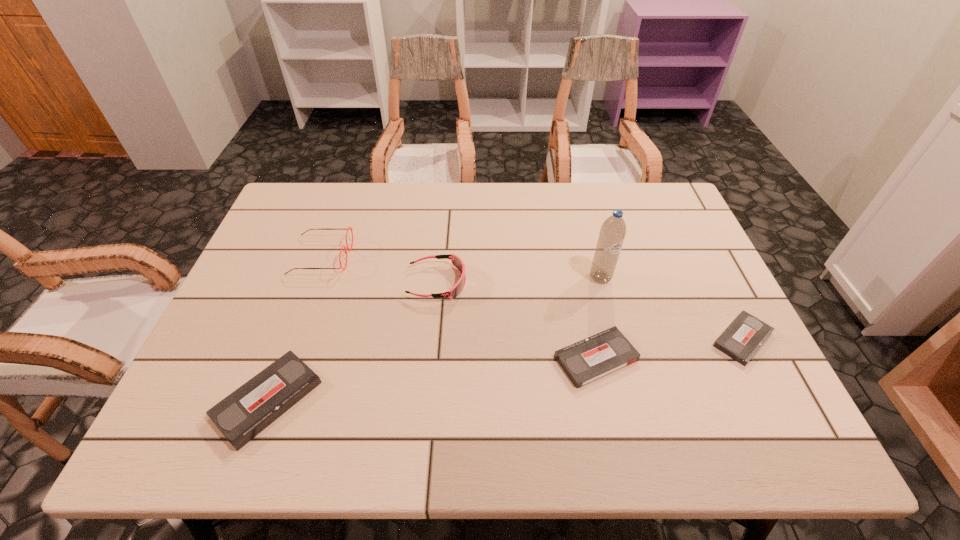
This screenshot has height=540, width=960. I want to click on vacant space located on the left of the second tallest videotape, so click(x=519, y=358).

Where is `free spot located on the back of the shortest object`? The width and height of the screenshot is (960, 540). free spot located on the back of the shortest object is located at coordinates (711, 278).

Image resolution: width=960 pixels, height=540 pixels. Find the location of `vacant space situated 0.390m on the front-facing side of the second tallest object`. vacant space situated 0.390m on the front-facing side of the second tallest object is located at coordinates (486, 256).

This screenshot has width=960, height=540. I want to click on blank space located on the front-facing side of the fourth shortest object, so click(515, 283).

The height and width of the screenshot is (540, 960). Identify the location of free space located 0.120m on the right of the tallest object. (656, 278).

I want to click on videotape at the left edge, so click(x=246, y=412).

Find the location of `spectacles located in the left edge section of the desktop`. spectacles located in the left edge section of the desktop is located at coordinates (351, 229).

Locate an element on the screen. object that is at the right edge is located at coordinates (745, 335).

I want to click on object that is positioned at the near left corner, so click(x=246, y=412).

In the image, there is a desktop. In order to click on free space at the far edge in this screenshot , I will do `click(460, 227)`.